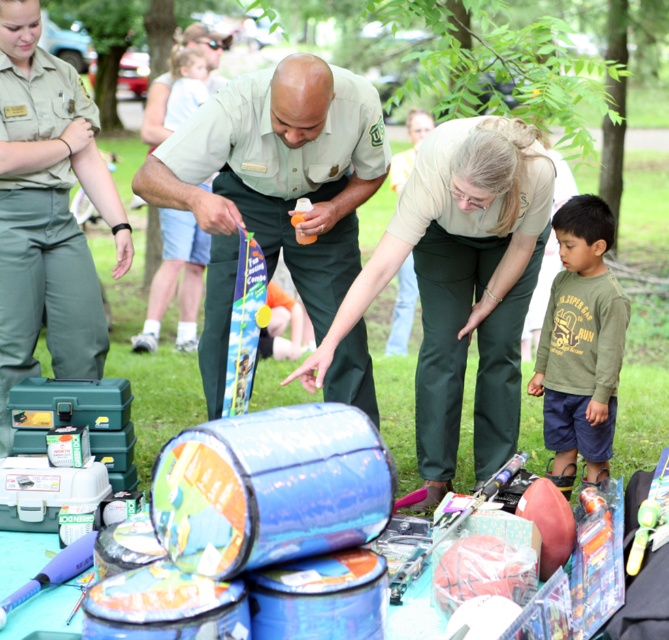
Question: Which object is closer to the camera taking this photo?

Choices:
 (A) green uniform at center
 (B) matte green pants at center
 (C) khaki uniform at center
 (D) translucent plastic bottle at center

Answer: (B)

Question: Is matte green pants at center closer to camera compared to khaki uniform at center?

Choices:
 (A) yes
 (B) no

Answer: (A)

Question: Is green uniform at center wider than khaki uniform at center?

Choices:
 (A) yes
 (B) no

Answer: (A)

Question: Does matte green pants at center appear on the right side of khaki uniform at center?

Choices:
 (A) no
 (B) yes

Answer: (B)

Question: Which object is the closest to the green cotton shirt at lower right?

Choices:
 (A) khaki uniform at center
 (B) translucent plastic bottle at center
 (C) green uniform at center
 (D) matte green pants at center

Answer: (D)

Question: Which point is closer to the camera taking this photo?

Choices:
 (A) (304, 211)
 (B) (66, 234)

Answer: (A)